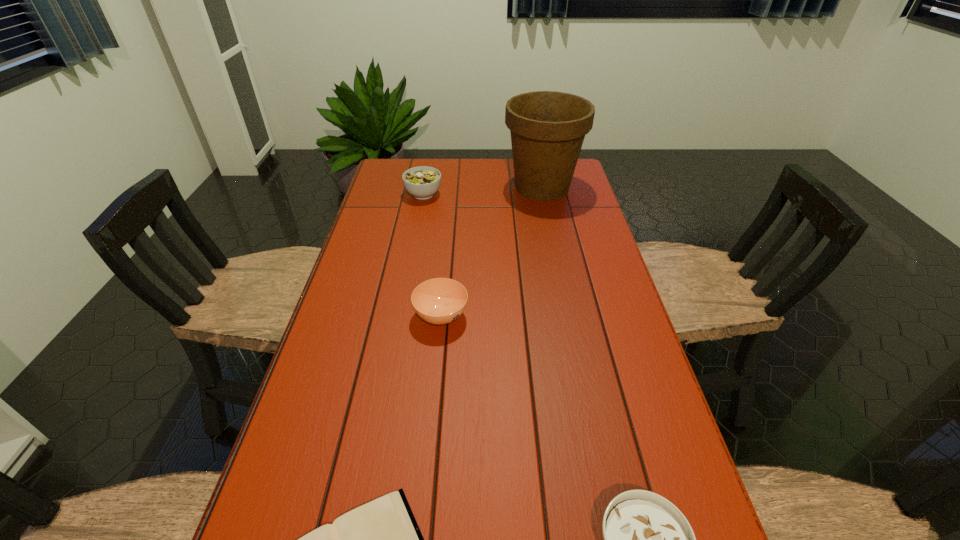
The height and width of the screenshot is (540, 960). In order to click on the closest soup bowl to the farthest soup bowl in this screenshot , I will do `click(439, 301)`.

Where is `the closest soup bowl to the third farthest object`? This screenshot has height=540, width=960. the closest soup bowl to the third farthest object is located at coordinates (646, 539).

Where is `free space that satisfies the following two spatial constraints: 1. on the front side of the farthest soup bowl; 2. on the left side of the second nearest soup bowl`? This screenshot has height=540, width=960. free space that satisfies the following two spatial constraints: 1. on the front side of the farthest soup bowl; 2. on the left side of the second nearest soup bowl is located at coordinates (400, 315).